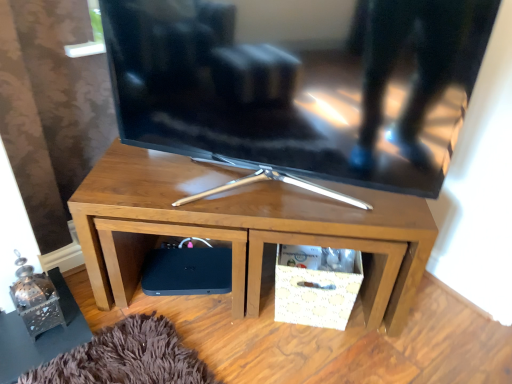
What are the coordinates of `free region under matte black tv at center (from a real-world perspective)` in the screenshot? It's located at (240, 187).